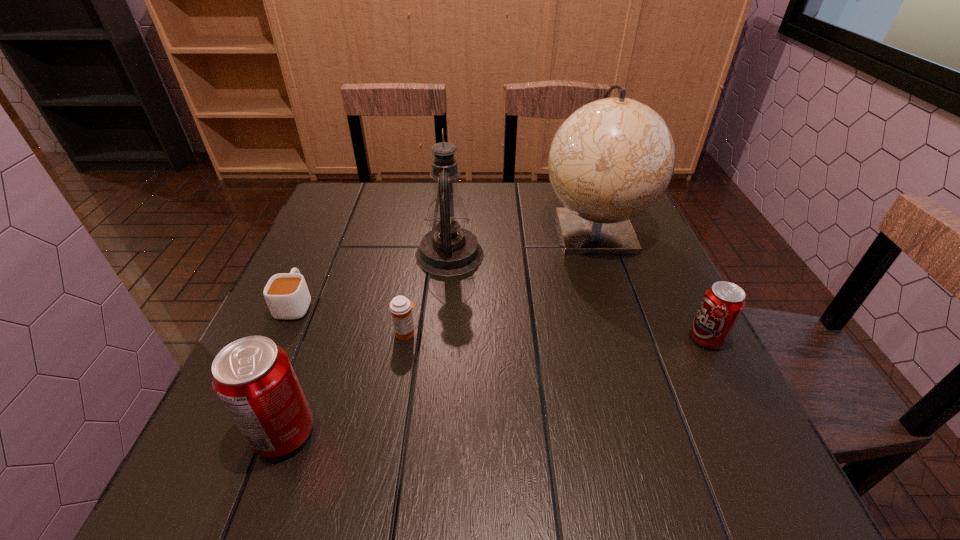
Where is `cup located at the left edge`? This screenshot has width=960, height=540. cup located at the left edge is located at coordinates (287, 296).

Locate an element on the screen. This screenshot has height=540, width=960. soda positioned at the right edge is located at coordinates (722, 304).

Where is `globe that is at the right edge`? The image size is (960, 540). globe that is at the right edge is located at coordinates (612, 159).

Locate an element on the screen. The height and width of the screenshot is (540, 960). object that is at the near left corner is located at coordinates (253, 378).

You are a GUI agent. You are given a task and a screenshot of the screen. Output one action in this format:
    pyautogui.click(x=<x>, y=<y>)
    Task: Click on the object positioned at the far right corner
    
    Given the screenshot: What is the action you would take?
    pyautogui.click(x=612, y=159)

The height and width of the screenshot is (540, 960). I want to click on vacant space at the far edge of the desktop, so click(x=490, y=184).

Image resolution: width=960 pixels, height=540 pixels. I want to click on vacant space at the near edge of the desktop, so click(x=355, y=398).

This screenshot has height=540, width=960. Identify the location of vacant point at the left edge. (370, 235).

Image resolution: width=960 pixels, height=540 pixels. I want to click on free space at the right edge of the desktop, so click(628, 340).

Where is `vacant point at the far left corner`? The image size is (960, 540). vacant point at the far left corner is located at coordinates point(347,204).